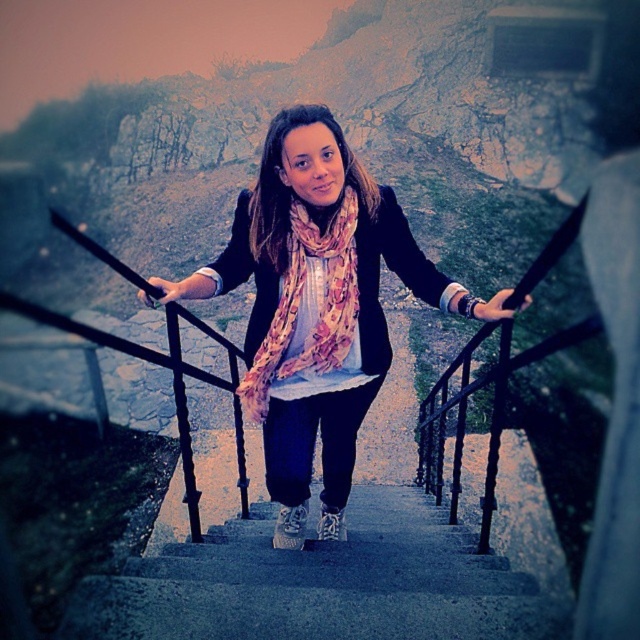
Question: Which object appears closest to the camera in this image?

Choices:
 (A) concrete stairs at center
 (B) floral silk scarf at center

Answer: (B)

Question: Can you confirm if pink floral scarf at center is smaller than floral silk scarf at center?

Choices:
 (A) yes
 (B) no

Answer: (B)

Question: Where is pink floral scarf at center located in relation to concrete stairs at center in the image?

Choices:
 (A) left
 (B) right

Answer: (A)

Question: Among these points, which one is nearest to the camera?

Choices:
 (A) (410, 497)
 (B) (314, 211)
 (C) (337, 355)

Answer: (B)

Question: Considering the real-world distances, which object is farthest from the pink floral scarf at center?

Choices:
 (A) floral silk scarf at center
 (B) concrete stairs at center

Answer: (B)

Question: Is the position of concrete stairs at center less distant than that of floral silk scarf at center?

Choices:
 (A) no
 (B) yes

Answer: (A)